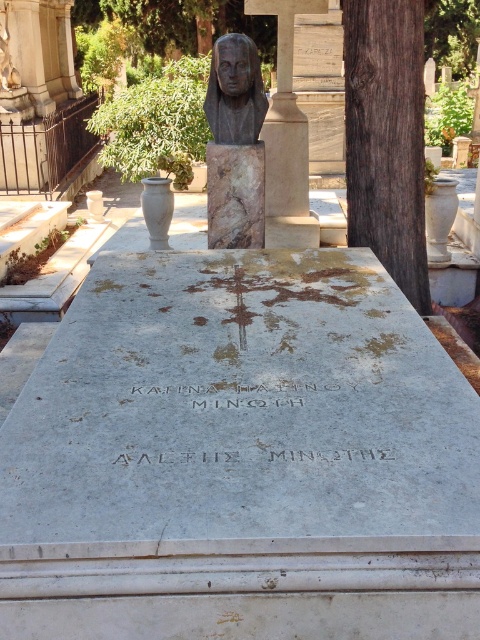
Question: Is dark brown wood at right further to camera compared to matte bronze bust at center?

Choices:
 (A) yes
 (B) no

Answer: (B)

Question: Is dark brown wood at right above matte bronze bust at center?

Choices:
 (A) yes
 (B) no

Answer: (B)

Question: Which of the following is the farthest from the observer?

Choices:
 (A) (219, 116)
 (B) (380, 209)

Answer: (A)

Question: Among these objects, which one is farthest from the camera?

Choices:
 (A) matte bronze bust at center
 (B) dark brown wood at right

Answer: (A)

Question: Which point is farther to the camera?

Choices:
 (A) (232, 54)
 (B) (348, 83)

Answer: (A)

Question: Can you confirm if dark brown wood at right is thinner than matte bronze bust at center?

Choices:
 (A) no
 (B) yes

Answer: (A)